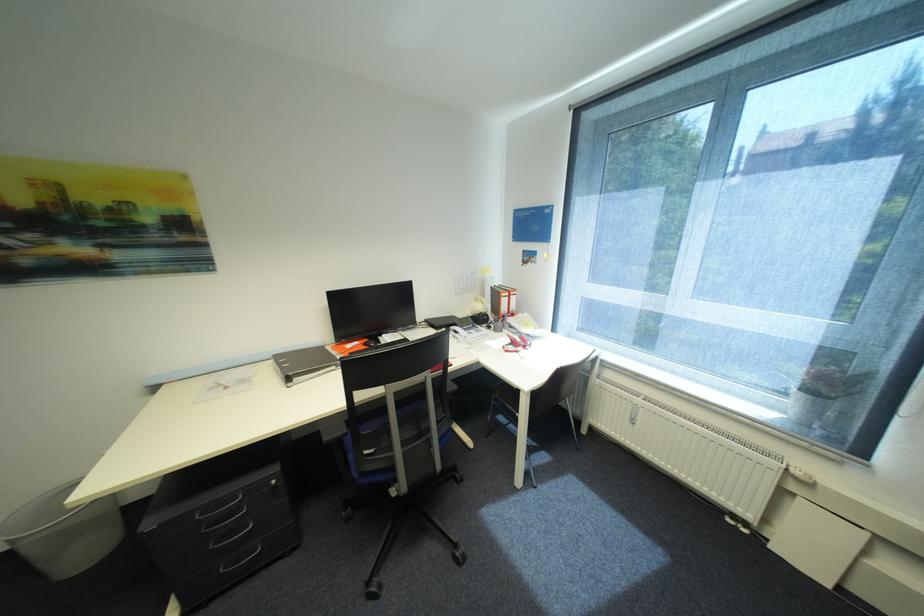
Find where to turn the white radiator valve. Please return your answer as a coordinate pair (x, y).

(634, 414)